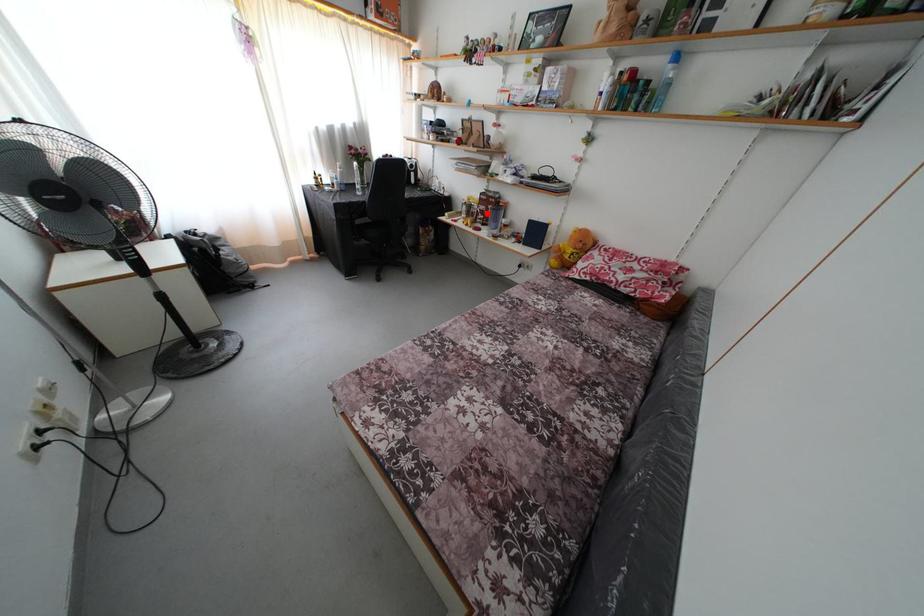
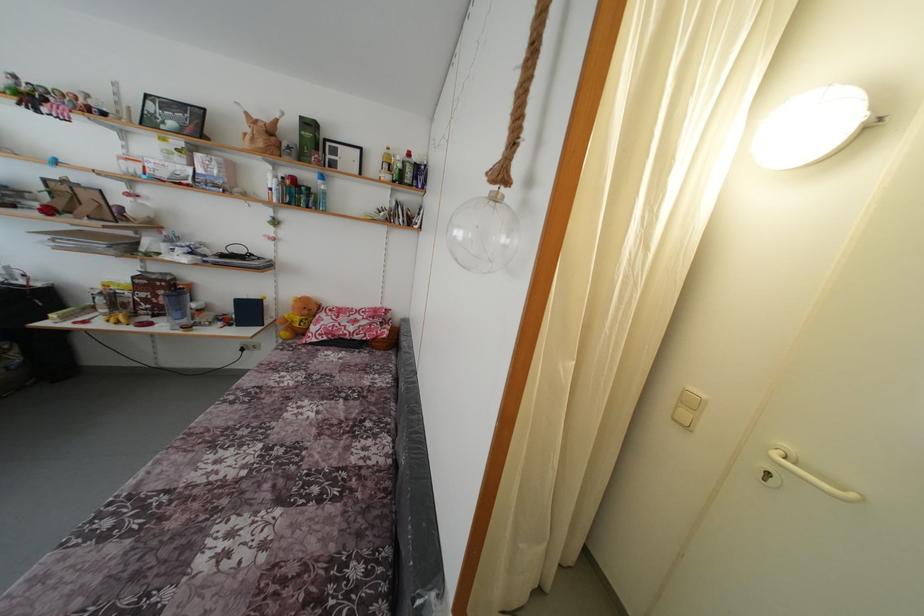
Question: I am providing you with two images of the same scene from different viewpoints. In image1, a red point is highlighted. Considering the same 3D point in image2, which of the following is correct?

Choices:
 (A) It is closer
 (B) It is farther

Answer: (B)